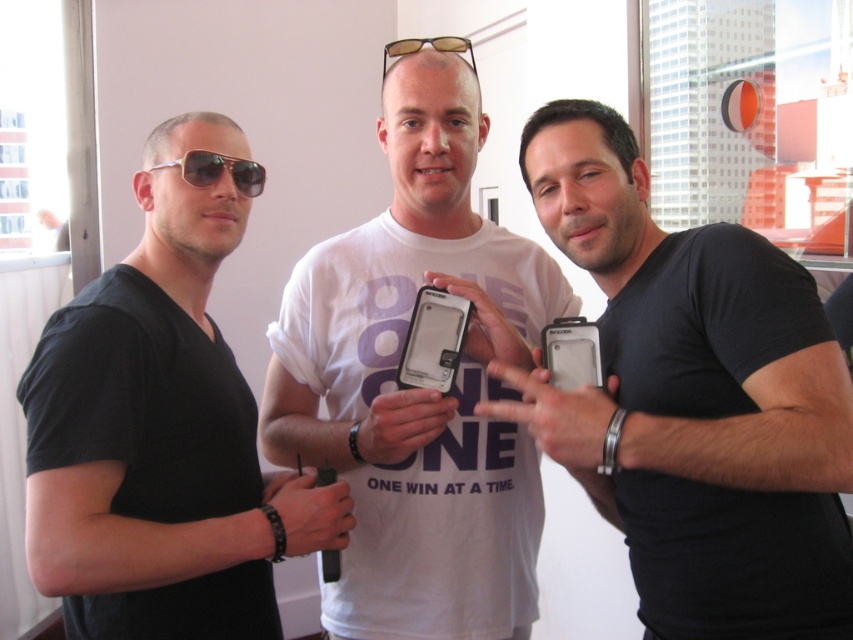
You are an office worker who needs to locate your sunglasses and phone. You remember leaving them somewhere in the office area shown. Based on the scene, where would you find the matte black sunglasses at left and the matte black phone at center?

The matte black sunglasses at left are positioned above the matte black phone at center, so you can find the sunglasses above the phone near the left side of the scene and the phone below them in the center area.

You are a delivery robot with a 15 inch wide package. You need to move from the window to the door in the office. The path is blocked by two objects, the matte black phone at center and the matte black sunglasses at left. Can you navigate between them?

The matte black phone at center and the matte black sunglasses at left are 20.35 inches apart. Since the package is 15 inches wide, there is enough space between the two objects for the robot to navigate through safely.